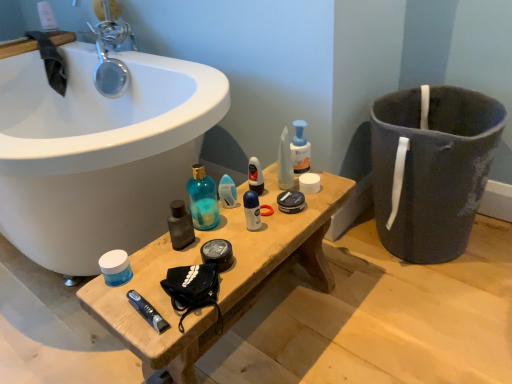
Identify the location of vacant space in front of shiny plastic mouthwash at center, which ranks as the second mouthwash in bottom-to-top order. This screenshot has width=512, height=384. (260, 220).